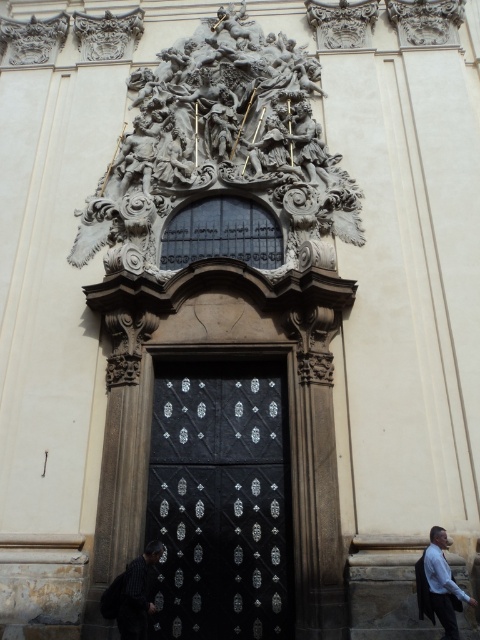
Can you confirm if polished stone sculpture at upper center is wider than striped shirt at lower left?

Yes, polished stone sculpture at upper center is wider than striped shirt at lower left.

Who is more distant from viewer, (x=159, y=225) or (x=144, y=552)?

Positioned behind is point (x=159, y=225).

Who is more distant from viewer, (228, 81) or (156, 548)?

Positioned behind is point (228, 81).

The height and width of the screenshot is (640, 480). I want to click on polished stone sculpture at upper center, so click(220, 144).

Which is more to the left, polished stone sculpture at upper center or black textured metal door at center?

polished stone sculpture at upper center

Can you confirm if polished stone sculpture at upper center is positioned to the right of black textured metal door at center?

Incorrect, polished stone sculpture at upper center is not on the right side of black textured metal door at center.

Where is `polished stone sculpture at upper center`? The image size is (480, 640). polished stone sculpture at upper center is located at coordinates (220, 144).

Based on the photo, is black textured metal door at center below light blue shirt at lower right?

Incorrect, black textured metal door at center is not positioned below light blue shirt at lower right.

Between black textured metal door at center and light blue shirt at lower right, which one is positioned lower?

light blue shirt at lower right is lower down.

At what (x,y) coordinates should I click in order to perform the action: click on black textured metal door at center. Please return your answer as a coordinate pair (x, y). This screenshot has width=480, height=640. Looking at the image, I should click on (219, 500).

Locate an element on the screen. This screenshot has width=480, height=640. black textured metal door at center is located at coordinates (219, 500).